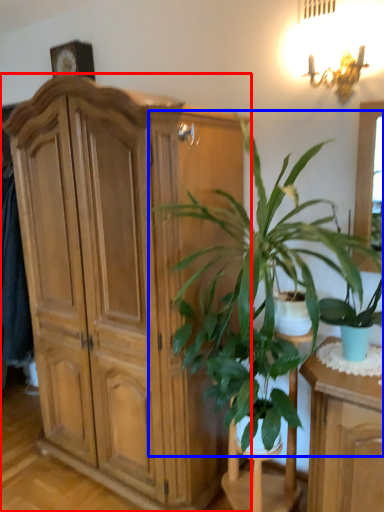
Question: Which of the following is the closest to the observer, cabinetry (highlighted by a red box) or houseplant (highlighted by a blue box)?

Choices:
 (A) cabinetry
 (B) houseplant

Answer: (B)